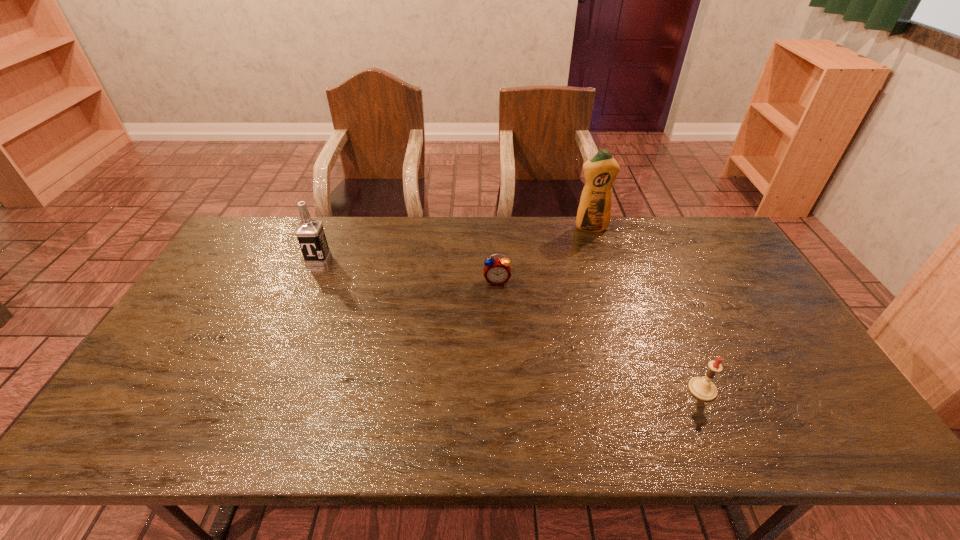
At what (x,y) coordinates should I click in order to perform the action: click on free space that satisfies the following two spatial constraints: 1. on the label of the candle; 2. on the left side of the second object from right to left. Please return your answer as a coordinate pair (x, y). Looking at the image, I should click on (641, 389).

I want to click on free location that satisfies the following two spatial constraints: 1. on the label of the rightmost object; 2. on the left side of the farthest object, so click(641, 389).

Where is `vacant region that satisfies the following two spatial constraints: 1. on the front-facing side of the nearest object; 2. on the right side of the second object from left to right`? The width and height of the screenshot is (960, 540). vacant region that satisfies the following two spatial constraints: 1. on the front-facing side of the nearest object; 2. on the right side of the second object from left to right is located at coordinates (501, 389).